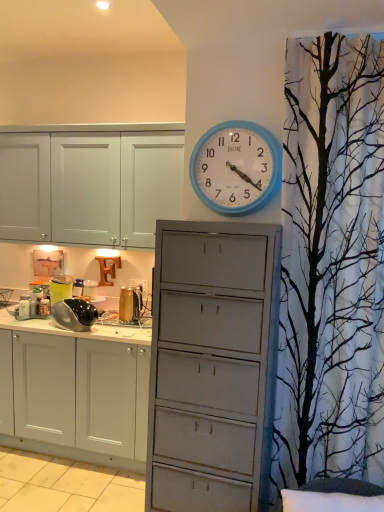
Question: Should I look upward or downward to see black glossy kettle at left, acting as the second appliance starting from the left?

Choices:
 (A) down
 (B) up

Answer: (A)

Question: From the image's perspective, is gold metallic kettle at center, placed as the 3th appliance when sorted from left to right, under metallic silver pot at left, placed as the 3th appliance when sorted from right to left?

Choices:
 (A) no
 (B) yes

Answer: (B)

Question: From a real-world perspective, is gold metallic kettle at center, acting as the 1th appliance starting from the right, positioned over metallic silver pot at left, placed as the 3th appliance when sorted from right to left, based on gravity?

Choices:
 (A) yes
 (B) no

Answer: (B)

Question: Does gold metallic kettle at center, acting as the 1th appliance starting from the right, have a smaller size compared to metallic silver pot at left, the first appliance when ordered from left to right?

Choices:
 (A) yes
 (B) no

Answer: (B)

Question: Is gold metallic kettle at center, acting as the 1th appliance starting from the right, closer to camera compared to metallic silver pot at left, the first appliance when ordered from left to right?

Choices:
 (A) no
 (B) yes

Answer: (B)

Question: Is gold metallic kettle at center, placed as the 3th appliance when sorted from left to right, taller than metallic silver pot at left, placed as the 3th appliance when sorted from right to left?

Choices:
 (A) no
 (B) yes

Answer: (A)

Question: Does gold metallic kettle at center, acting as the 1th appliance starting from the right, come behind metallic silver pot at left, the first appliance when ordered from left to right?

Choices:
 (A) no
 (B) yes

Answer: (A)

Question: Does blue plastic wall clock at upper center have a smaller size compared to metallic silver pot at left, placed as the 3th appliance when sorted from right to left?

Choices:
 (A) no
 (B) yes

Answer: (A)

Question: From the image's perspective, would you say blue plastic wall clock at upper center is shown under metallic silver pot at left, placed as the 3th appliance when sorted from right to left?

Choices:
 (A) yes
 (B) no

Answer: (B)

Question: From a real-world perspective, is blue plastic wall clock at upper center physically below metallic silver pot at left, the first appliance when ordered from left to right?

Choices:
 (A) no
 (B) yes

Answer: (A)

Question: Is blue plastic wall clock at upper center at the right side of metallic silver pot at left, the first appliance when ordered from left to right?

Choices:
 (A) yes
 (B) no

Answer: (A)

Question: Is blue plastic wall clock at upper center with metallic silver pot at left, placed as the 3th appliance when sorted from right to left?

Choices:
 (A) yes
 (B) no

Answer: (B)

Question: Is blue plastic wall clock at upper center further to camera compared to metallic silver pot at left, placed as the 3th appliance when sorted from right to left?

Choices:
 (A) yes
 (B) no

Answer: (B)

Question: Considering the relative positions of black glossy kettle at left, acting as the second appliance starting from the left, and blue plastic wall clock at upper center in the image provided, is black glossy kettle at left, acting as the second appliance starting from the left, to the right of blue plastic wall clock at upper center from the viewer's perspective?

Choices:
 (A) yes
 (B) no

Answer: (B)